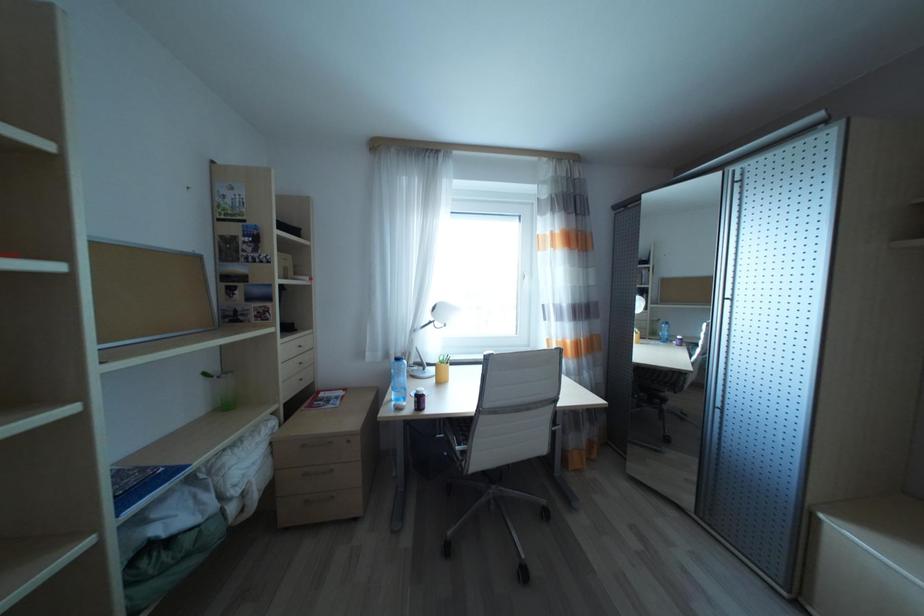
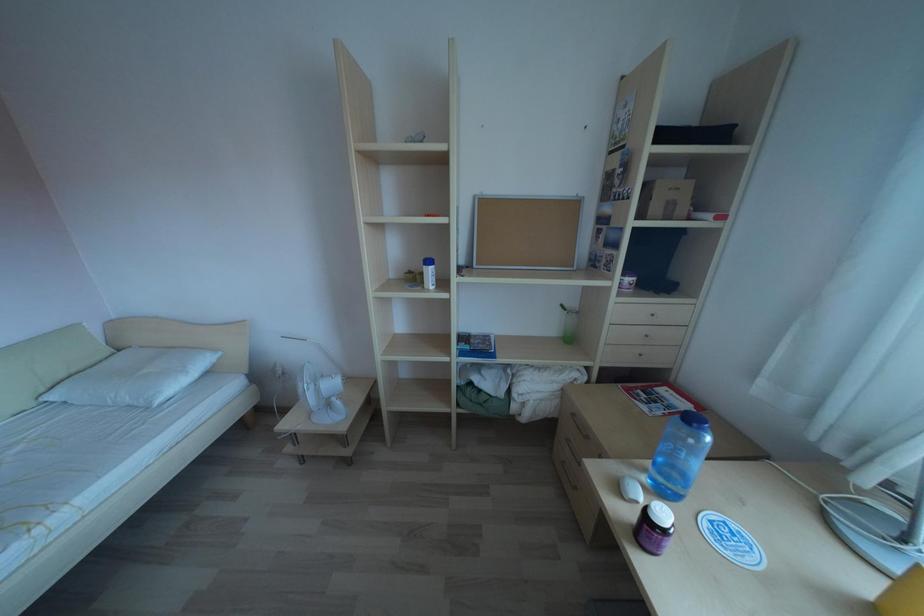
The images are taken continuously from a first-person perspective. In which direction is your viewpoint rotating?

The rotation direction of the camera is left-down.